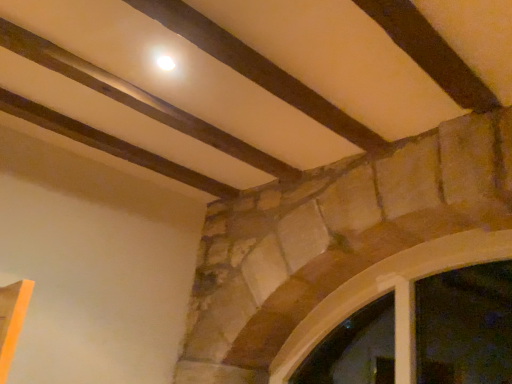
In order to face smooth stone window at center, should I rotate leftwards or rightwards?

To face it directly, rotate right by 13.427 degrees.

Identify the location of smooth stone window at center. (387, 287).

The image size is (512, 384). Describe the element at coordinates (387, 287) in the screenshot. I see `smooth stone window at center` at that location.

Find the location of a particular element. smooth stone window at center is located at coordinates (387, 287).